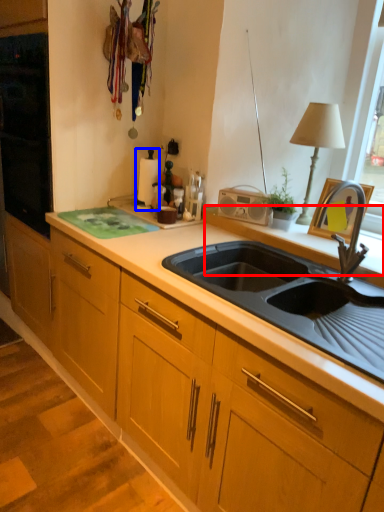
Question: Among these objects, which one is nearest to the camera, window sill (highlighted by a red box) or appliance (highlighted by a blue box)?

Choices:
 (A) window sill
 (B) appliance

Answer: (A)